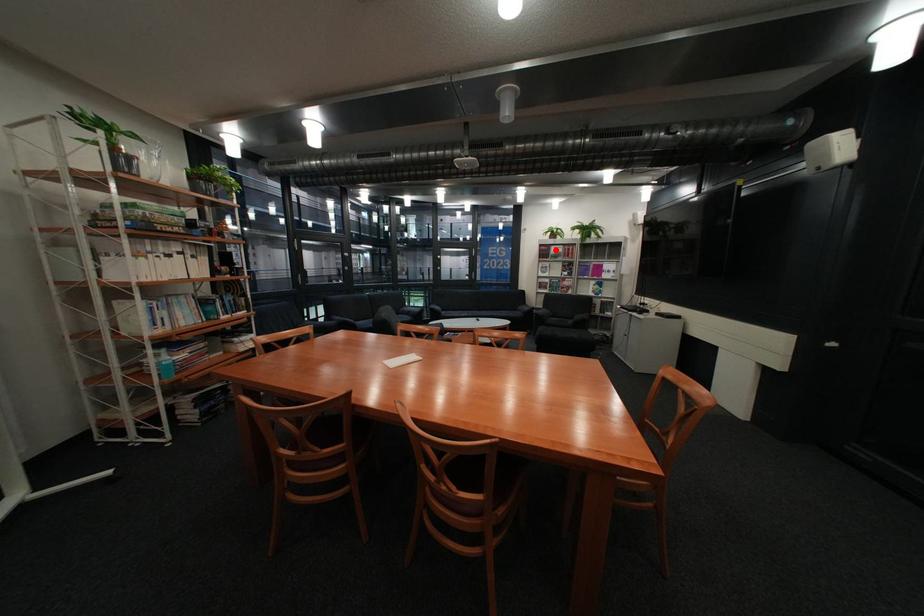
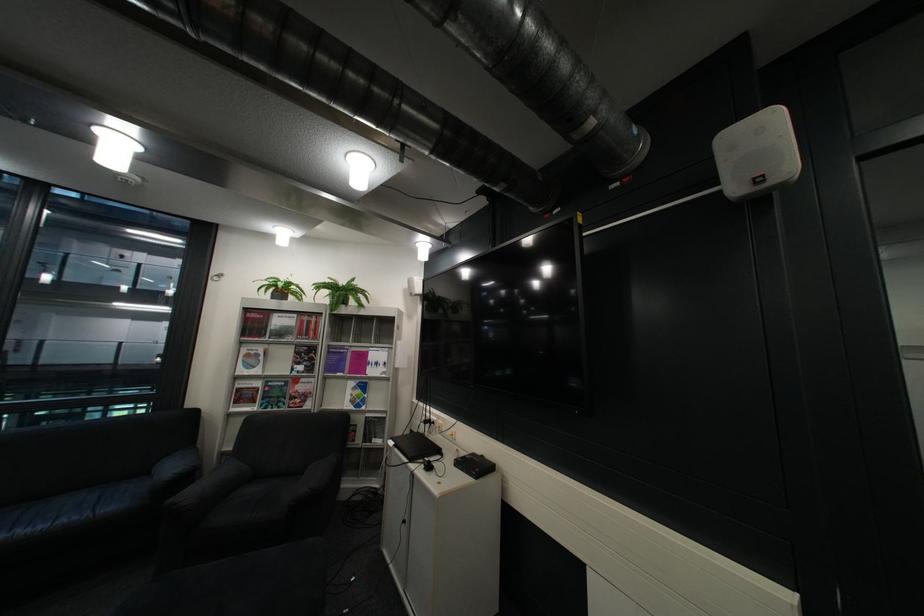
Question: I am providing you with two images of the same scene from different viewpoints. In image1, a red point is highlighted. Considering the same 3D point in image2, which of the following is correct?

Choices:
 (A) It is closer
 (B) It is farther

Answer: (B)